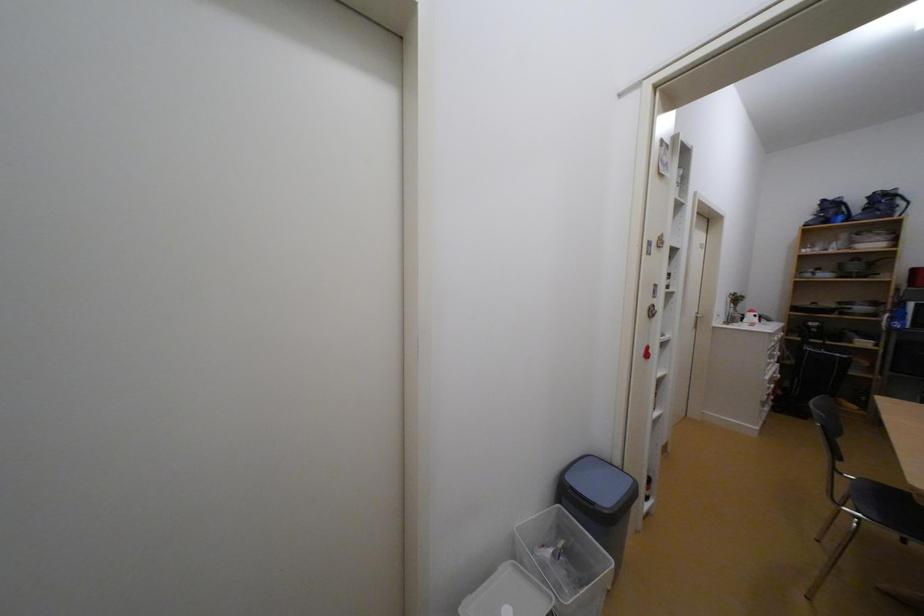
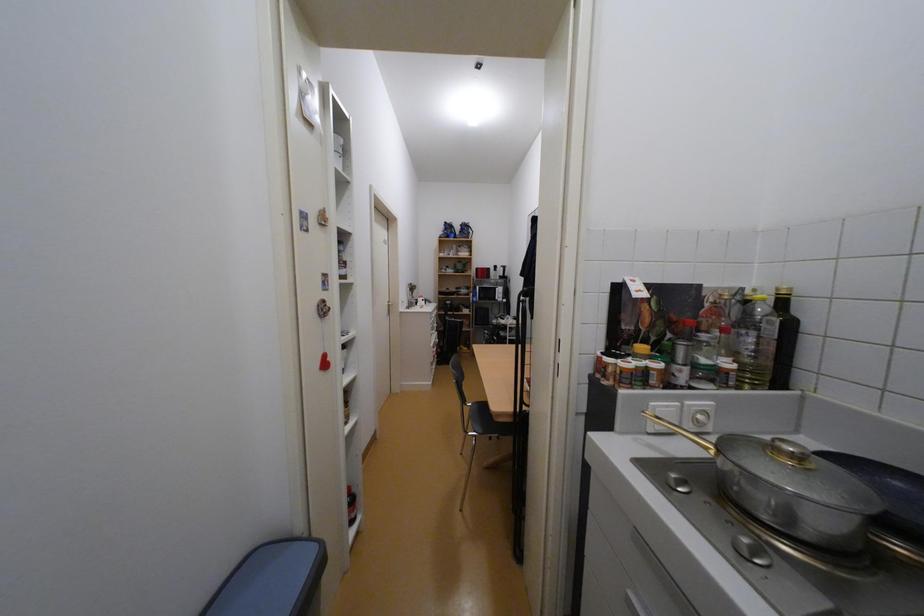
Question: How did the camera likely rotate?

Choices:
 (A) Left
 (B) Right
 (C) Up
 (D) Down

Answer: (B)